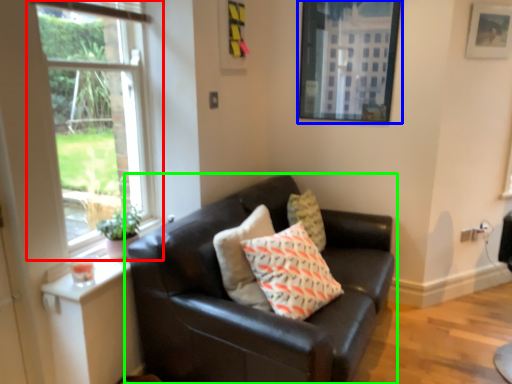
Question: Which object is positioned farthest from window (highlighted by a red box)? Select from picture frame (highlighted by a blue box) and studio couch (highlighted by a green box).

Choices:
 (A) picture frame
 (B) studio couch

Answer: (A)